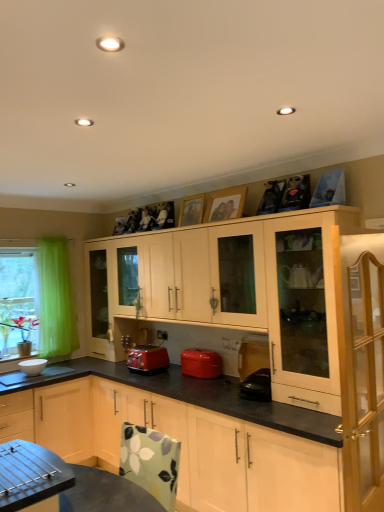
Question: Considering the relative positions of matte red toaster at center, the first kitchen appliance from the left, and light wood cabinet at right, positioned as the 1th cabinetry in front-to-back order, in the image provided, is matte red toaster at center, the first kitchen appliance from the left, to the left of light wood cabinet at right, positioned as the 1th cabinetry in front-to-back order, from the viewer's perspective?

Choices:
 (A) no
 (B) yes

Answer: (B)

Question: Is matte red toaster at center, the second kitchen appliance when ordered from right to left, positioned behind light wood cabinet at right, positioned as the 1th cabinetry in front-to-back order?

Choices:
 (A) no
 (B) yes

Answer: (B)

Question: Is matte red toaster at center, the first kitchen appliance from the left, smaller than light wood cabinet at right, positioned as the 1th cabinetry in front-to-back order?

Choices:
 (A) no
 (B) yes

Answer: (B)

Question: Can you confirm if matte red toaster at center, the first kitchen appliance from the left, is thinner than light wood cabinet at right, which appears as the third cabinetry when viewed from the back?

Choices:
 (A) no
 (B) yes

Answer: (A)

Question: Does matte red toaster at center, the second kitchen appliance when ordered from right to left, appear on the right side of light wood cabinet at right, which appears as the third cabinetry when viewed from the back?

Choices:
 (A) no
 (B) yes

Answer: (A)

Question: From the image's perspective, is matte red toaster at center, the second kitchen appliance when ordered from right to left, on top of light wood cabinet at right, which appears as the third cabinetry when viewed from the back?

Choices:
 (A) no
 (B) yes

Answer: (A)

Question: Considering the relative positions of green sheer curtain at left and light wood cabinet at center, positioned as the second cabinetry in front-to-back order, in the image provided, is green sheer curtain at left to the left of light wood cabinet at center, positioned as the second cabinetry in front-to-back order, from the viewer's perspective?

Choices:
 (A) no
 (B) yes

Answer: (B)

Question: From the image's perspective, does green sheer curtain at left appear lower than light wood cabinet at center, placed as the second cabinetry when sorted from back to front?

Choices:
 (A) yes
 (B) no

Answer: (B)

Question: Is green sheer curtain at left wider than light wood cabinet at center, placed as the second cabinetry when sorted from back to front?

Choices:
 (A) yes
 (B) no

Answer: (B)

Question: Does green sheer curtain at left have a larger size compared to light wood cabinet at center, positioned as the second cabinetry in front-to-back order?

Choices:
 (A) yes
 (B) no

Answer: (B)

Question: From a real-world perspective, does green sheer curtain at left stand above light wood cabinet at center, positioned as the second cabinetry in front-to-back order?

Choices:
 (A) no
 (B) yes

Answer: (B)

Question: Can you confirm if green sheer curtain at left is thinner than light wood cabinet at center, placed as the second cabinetry when sorted from back to front?

Choices:
 (A) yes
 (B) no

Answer: (A)

Question: Would you consider light wood cabinet at right, positioned as the 1th cabinetry in front-to-back order, to be distant from light wood cabinet at upper right, placed as the third cabinetry when sorted from front to back?

Choices:
 (A) no
 (B) yes

Answer: (A)